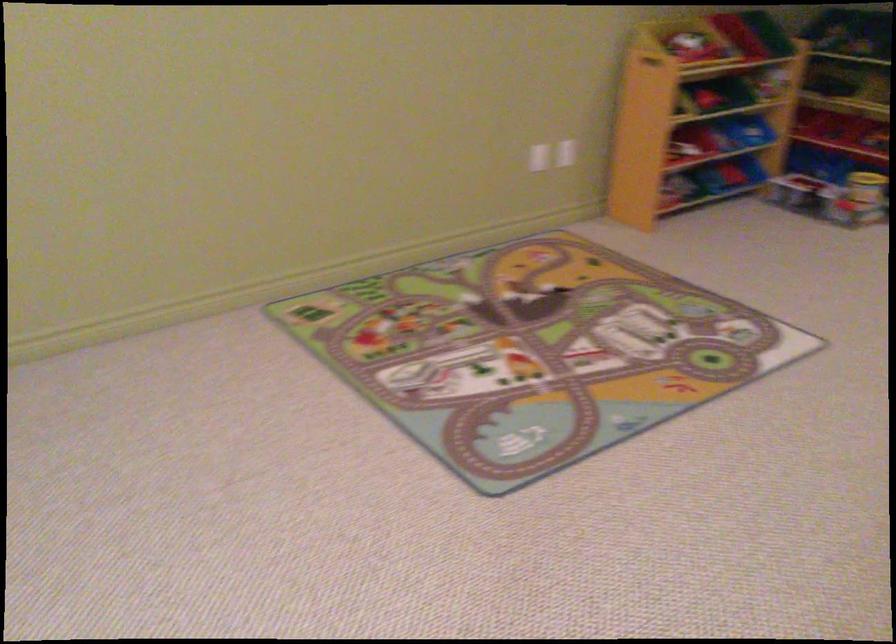
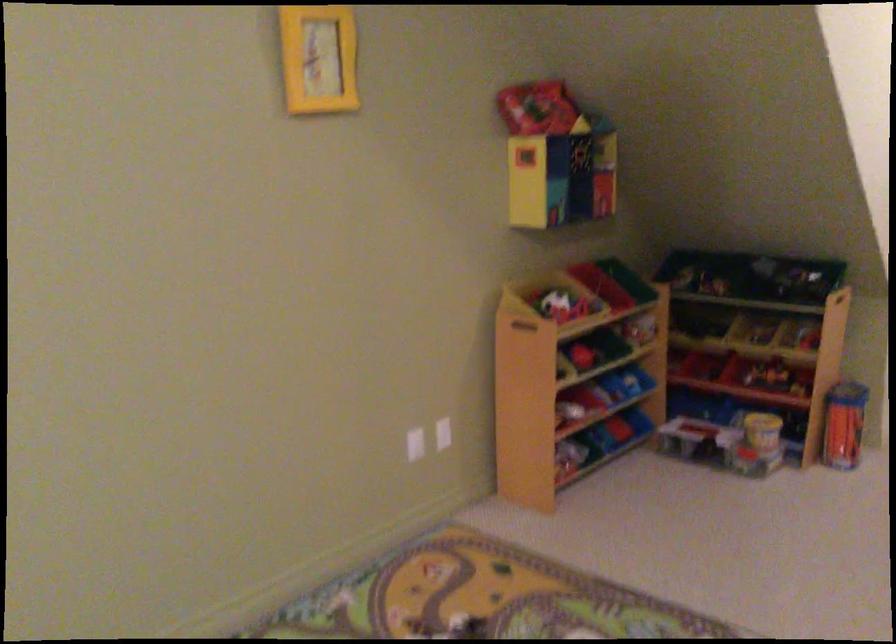
Question: The images are taken continuously from a first-person perspective. In which direction is your viewpoint rotating?

Choices:
 (A) Left
 (B) Right
 (C) Up
 (D) Down

Answer: (C)